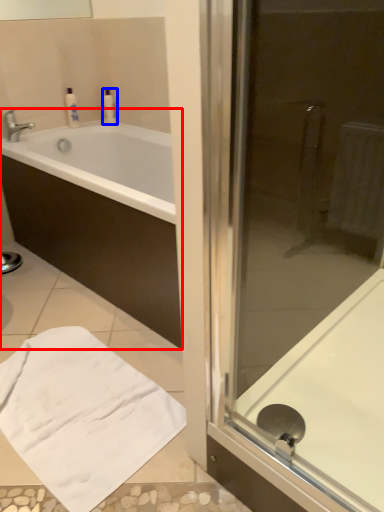
Question: Which point is closer to the camera, bathtub (highlighted by a red box) or toiletry (highlighted by a blue box)?

Choices:
 (A) bathtub
 (B) toiletry

Answer: (A)